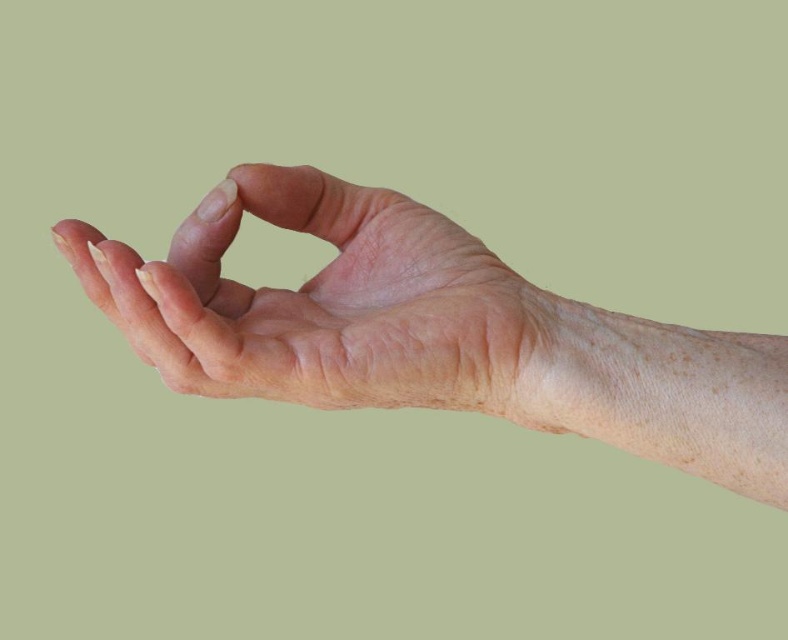
You are a medical student examining the hand in the image. You notice two points marked on the skin. The first point is at coordinate point (326,298) and the second is at point (158,292). Based on their positions, which point is closer to your eyes?

Point (326,298) is further to the viewer than point (158,292), so the point closer to your eyes is point (326,298).

You are a medical student observing a closeup image of a hand. The hand has visible wrinkles, age spots, and veins. You need to measure the distance between your eyes and the dry skin hand at center. What is the approximate distance in inches?

The dry skin hand at center is 16.87 inches away from the viewer, so the approximate distance between your eyes and the dry skin hand at center is 16.87 inches.

Based on the scene description, which hand is positioned higher up in the image? The dry skin hand at center or the smooth skin hand at center?

The dry skin hand at center is taller than the smooth skin hand at center, so the dry skin hand at center is positioned higher up in the image.